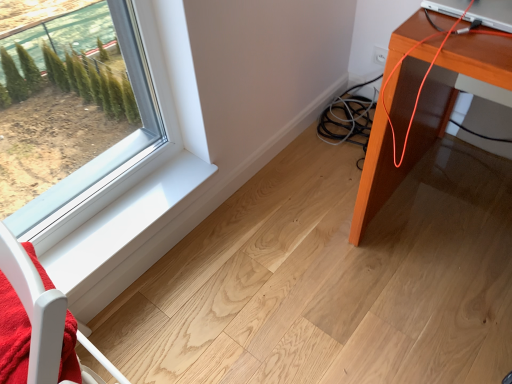
Question: Visually, is orange wood table at right positioned to the left or to the right of white smooth window sill at lower left?

Choices:
 (A) right
 (B) left

Answer: (A)

Question: Is orange wood table at right taller or shorter than white smooth window sill at lower left?

Choices:
 (A) tall
 (B) short

Answer: (A)

Question: Estimate the real-world distances between objects in this image. Which object is farther from the silver metallic laptop at upper right?

Choices:
 (A) orange wood table at right
 (B) white smooth window sill at lower left
 (C) white wood chair at lower left

Answer: (B)

Question: Which is nearer to the silver metallic laptop at upper right?

Choices:
 (A) white wood chair at lower left
 (B) orange wood table at right
 (C) white smooth window sill at lower left

Answer: (B)